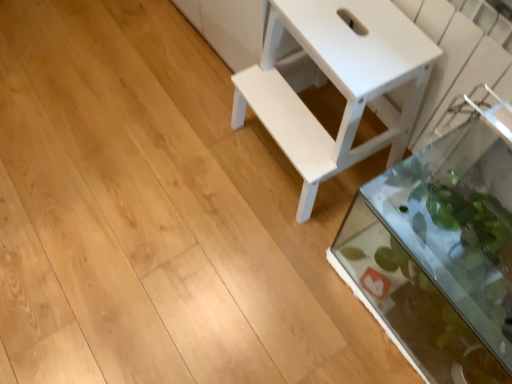
Where is `free spot above white matte table at center (from a real-world perspective)`? free spot above white matte table at center (from a real-world perspective) is located at coordinates (349, 34).